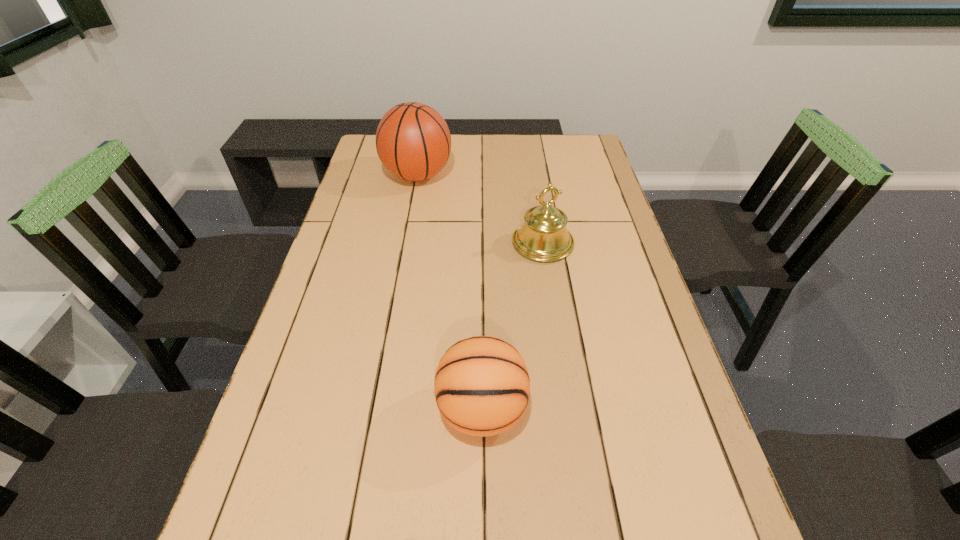
Where is `object that is at the right edge`? object that is at the right edge is located at coordinates (543, 237).

This screenshot has width=960, height=540. I want to click on object that is at the far left corner, so click(x=413, y=141).

In order to click on blank space at the far edge in this screenshot , I will do `click(528, 147)`.

The height and width of the screenshot is (540, 960). What are the coordinates of `free space at the left edge of the desktop` in the screenshot? It's located at (320, 478).

At what (x,y) coordinates should I click in order to perform the action: click on vacant region at the right edge of the desktop. Please return your answer as a coordinate pair (x, y). This screenshot has width=960, height=540. Looking at the image, I should click on (637, 511).

The image size is (960, 540). In the image, there is a desktop. Find the location of `vacant space at the far right corner`. vacant space at the far right corner is located at coordinates (589, 159).

Where is `unoccupied position between the right basketball and the bell`? unoccupied position between the right basketball and the bell is located at coordinates [513, 326].

Find the location of `vacant area between the nearer basketball and the second farthest object`. vacant area between the nearer basketball and the second farthest object is located at coordinates (513, 326).

Identify the location of vacant area between the bell and the shorter basketball. The height and width of the screenshot is (540, 960). (513, 326).

What are the coordinates of `free space between the nearest object and the second farthest object` in the screenshot? It's located at (513, 326).